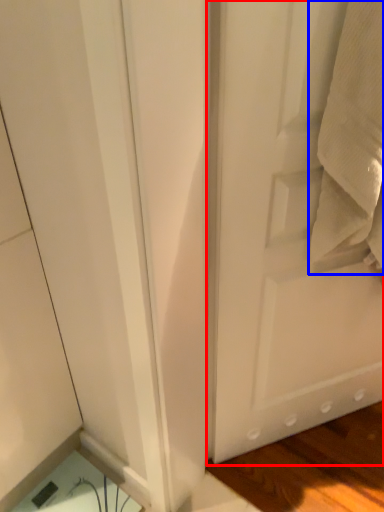
Question: Which of the following is the closest to the observer, door (highlighted by a red box) or bath towel (highlighted by a blue box)?

Choices:
 (A) door
 (B) bath towel

Answer: (B)